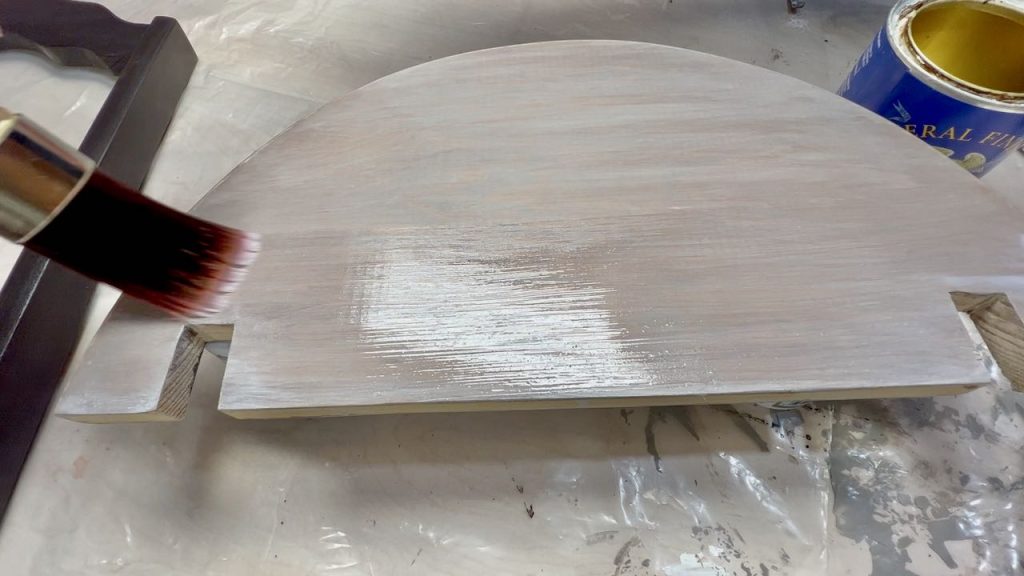
Image resolution: width=1024 pixels, height=576 pixels. I want to click on partial front pf paint can, so click(961, 131).